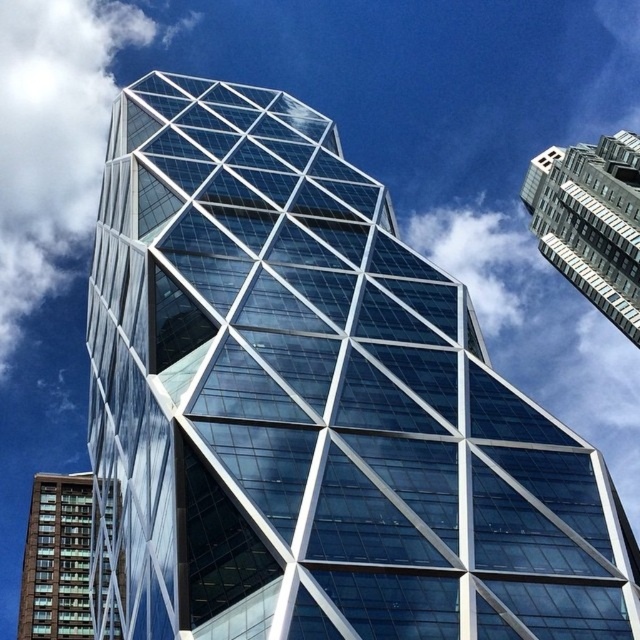
Who is more distant from viewer, (19, 211) or (81, 602)?

Positioned behind is point (19, 211).

This screenshot has width=640, height=640. What are the coordinates of `white fluffy cloud at upper left` in the screenshot? It's located at (54, 138).

Identify the location of white fluffy cloud at upper left. (54, 138).

Is point (36, 257) closer to camera compared to point (604, 257)?

No, (36, 257) is further to viewer.

Identify the location of white fluffy cloud at upper left. (x=54, y=138).

Is glassy steel skyscraper at upper right taller than green glass building at lower left?

Yes.

Can you confirm if glassy steel skyscraper at upper right is positioned above green glass building at lower left?

Correct, glassy steel skyscraper at upper right is located above green glass building at lower left.

Who is more distant from viewer, (598, 266) or (17, 634)?

The point (17, 634) is more distant.

This screenshot has width=640, height=640. I want to click on glassy steel skyscraper at upper right, so click(592, 221).